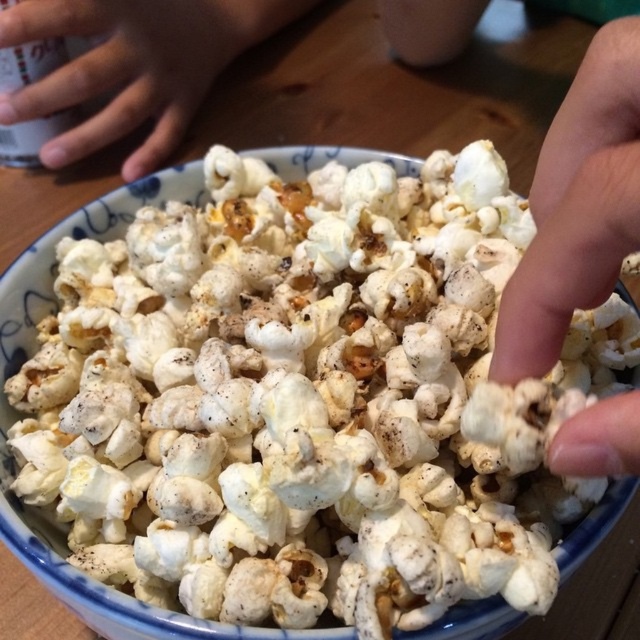
The width and height of the screenshot is (640, 640). Describe the element at coordinates (577, 205) in the screenshot. I see `flesh-toned skin at upper right` at that location.

Does point (612, 182) lie in front of point (186, 72)?

Yes.

This screenshot has height=640, width=640. Find the location of `flesh-toned skin at upper right`. flesh-toned skin at upper right is located at coordinates (577, 205).